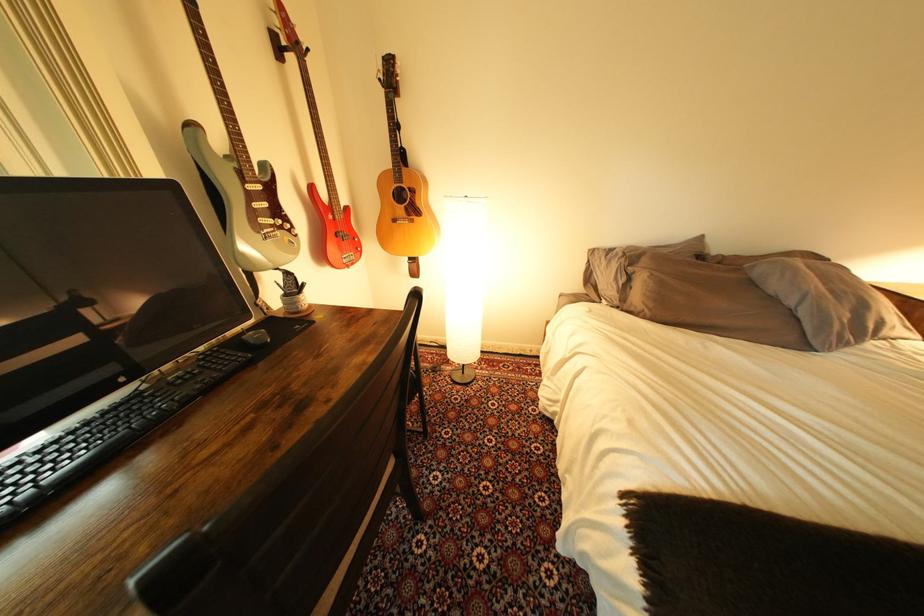
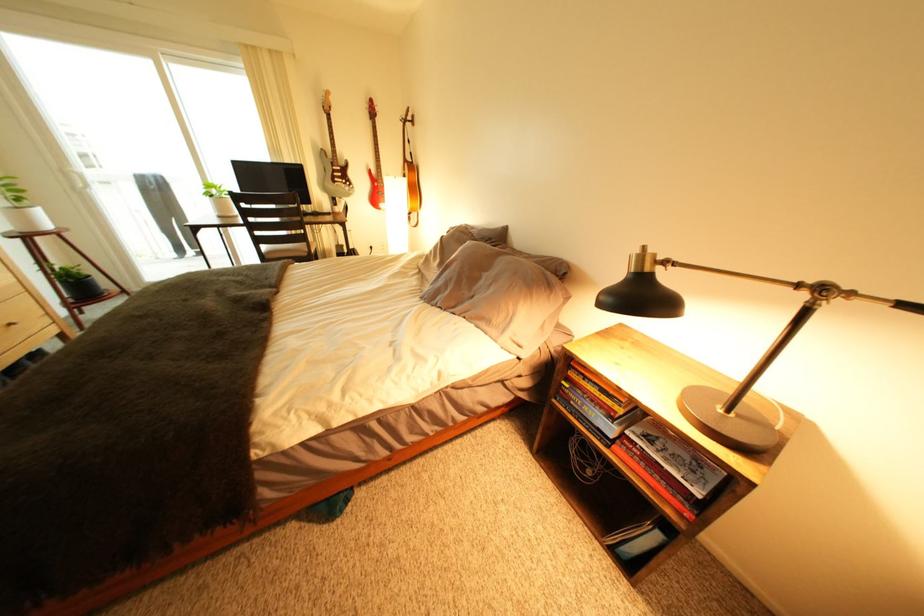
The point at (278, 233) is marked in the first image. Where is the corresponding point in the second image?

(349, 185)